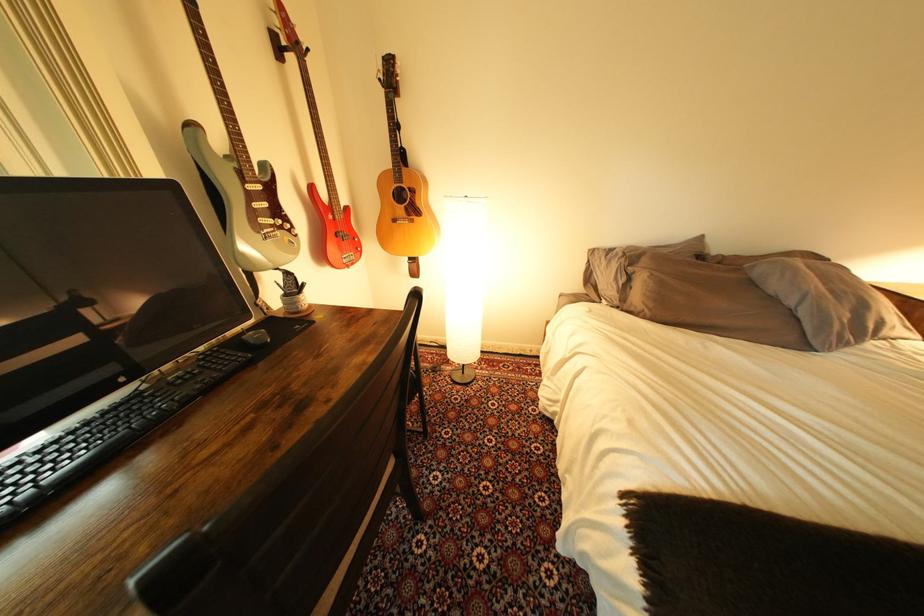
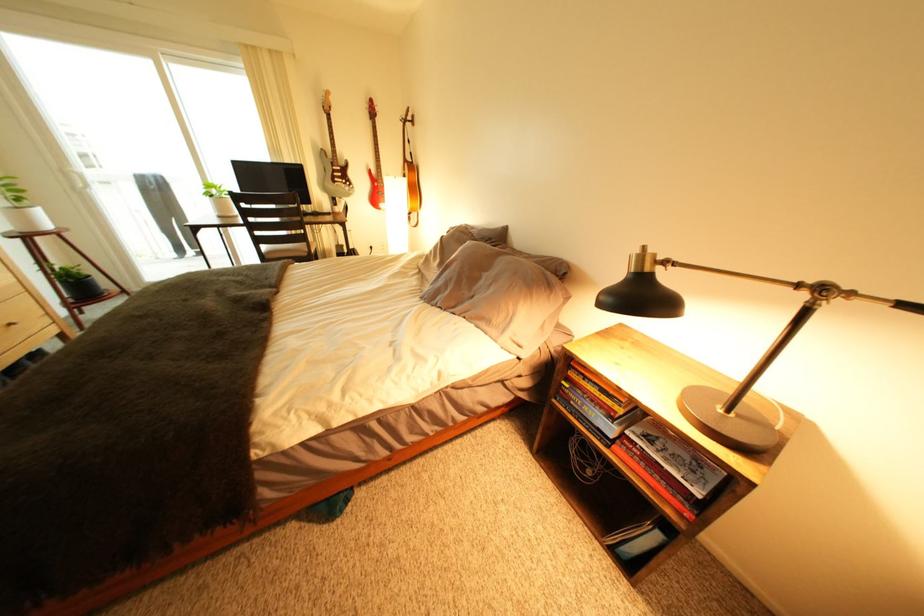
The point at (278, 233) is marked in the first image. Where is the corresponding point in the second image?

(349, 185)